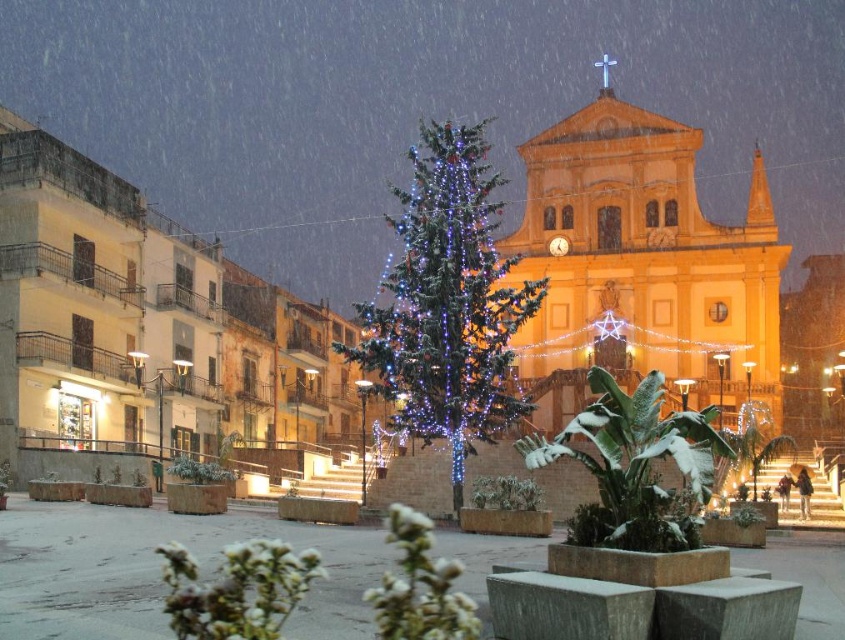
You are a photographer trying to capture the festive scene. You notice the illuminated green pine at center and the white snowy plant at center. Which object should you focus on first if you want to photograph the one that is higher in the frame?

The illuminated green pine at center is above the white snowy plant at center, so you should focus on the illuminated green pine at center first as it is higher in the frame.

You are a photographer trying to capture a shot of the festive scene. You want to ensure that both the illuminated green pine at center and the white snowy plant at center are fully visible in your frame. Given that your camera lens has a maximum width capacity of 2 meters, can you determine if both objects will fit within the frame?

The illuminated green pine at center might be wider than white snowy plant at center. Since the maximum width capacity is 2 meters, but the exact width of the illuminated green pine at center is not specified, it is uncertain whether both objects will fit within the frame.

You are a photographer trying to capture the illuminated green pine at center and the white snowy plant at center in the same frame. However, you can only focus on one object at a time. Which object should you focus on to ensure the other remains in the background?

You should focus on the illuminated green pine at center because the white snowy plant at center is behind it, so focusing on the pine will keep the snowy plant in the background.